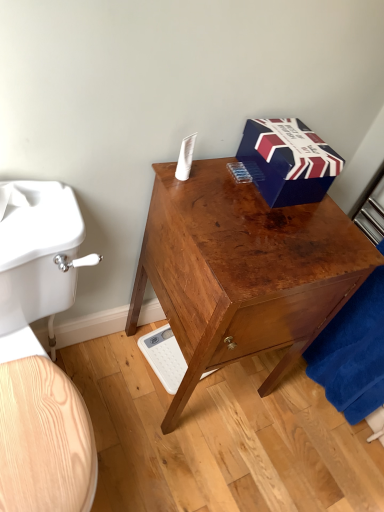
Identify the location of free space in front of velvety blue towel at lower right. (314, 442).